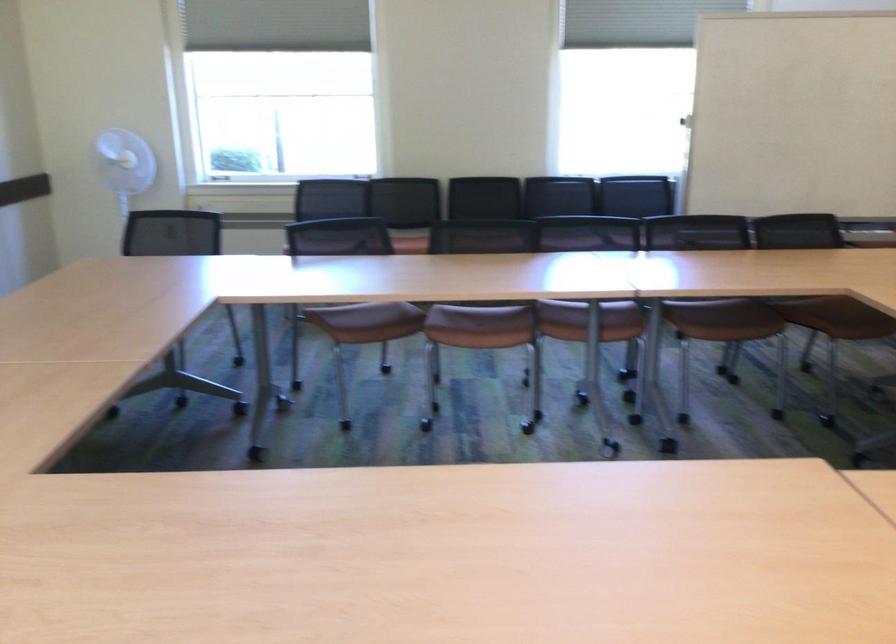
Describe the element at coordinates (124, 164) in the screenshot. I see `a white pedestal fan` at that location.